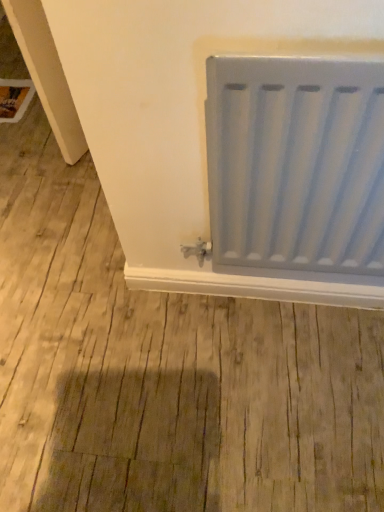
Locate an element on the screen. The height and width of the screenshot is (512, 384). free space to the left of white matte window sill at lower center is located at coordinates (116, 329).